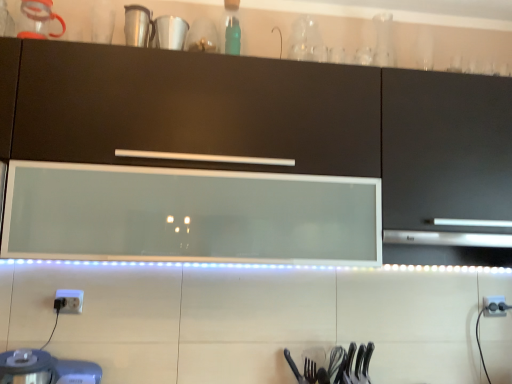
What is the approximate height of white glossy cup at upper center?

4.80 inches.

Measure the distance between transparent glass range hood at center and camera.

They are 4.12 feet apart.

Describe the element at coordinates (495, 306) in the screenshot. The image size is (512, 384). I see `white plastic electric outlet at lower right, the first electric outlet in the bottom-to-top sequence` at that location.

At what (x,y) coordinates should I click in order to perform the action: click on white plastic electric outlet at lower right, the first electric outlet in the bottom-to-top sequence. Please return your answer as a coordinate pair (x, y). Image resolution: width=512 pixels, height=384 pixels. Looking at the image, I should click on (495, 306).

The height and width of the screenshot is (384, 512). Identify the location of metallic silver blender at lower left. (45, 369).

Measure the distance between polished metal fork at lower center and camera.

5.27 feet.

This screenshot has height=384, width=512. Find the location of `white glossy cup at upper center`. white glossy cup at upper center is located at coordinates (170, 32).

From the image's perspective, does white glossy cup at upper center appear higher than transparent glass range hood at center?

Correct, white glossy cup at upper center appears higher than transparent glass range hood at center in the image.

Which of these two, white glossy cup at upper center or transparent glass range hood at center, stands shorter?

Standing shorter between the two is white glossy cup at upper center.

Does white glossy cup at upper center appear on the left side of transparent glass range hood at center?

Correct, you'll find white glossy cup at upper center to the left of transparent glass range hood at center.

In the scene shown: Is white glossy cup at upper center thinner than transparent glass range hood at center?

Yes, white glossy cup at upper center is thinner than transparent glass range hood at center.

From a real-world perspective, is metallic silver blender at lower left over white plastic electric outlet at lower left, positioned as the second electric outlet in right-to-left order?

No, from a real-world perspective, metallic silver blender at lower left is not over white plastic electric outlet at lower left, positioned as the second electric outlet in right-to-left order

Is metallic silver blender at lower left bigger than white plastic electric outlet at lower left, which ranks as the second electric outlet in bottom-to-top order?

Correct, metallic silver blender at lower left is larger in size than white plastic electric outlet at lower left, which ranks as the second electric outlet in bottom-to-top order.

Between metallic silver blender at lower left and white plastic electric outlet at lower left, which ranks as the second electric outlet in bottom-to-top order, which one has smaller width?

white plastic electric outlet at lower left, which ranks as the second electric outlet in bottom-to-top order, is thinner.

Could white plastic electric outlet at lower left, which is counted as the 2th electric outlet, starting from the back, be considered to be inside metallic silver blender at lower left?

No, white plastic electric outlet at lower left, which is counted as the 2th electric outlet, starting from the back, is located outside of metallic silver blender at lower left.

From a real-world perspective, is transparent glass range hood at center on matte black cabinet at center?

No, from a real-world perspective, transparent glass range hood at center is not on top of matte black cabinet at center.

From the image's perspective, is transparent glass range hood at center above matte black cabinet at center?

No.

Is transparent glass range hood at center far from matte black cabinet at center?

No, transparent glass range hood at center is not far away from matte black cabinet at center.

Does transparent glass range hood at center have a larger size compared to matte black cabinet at center?

Actually, transparent glass range hood at center might be smaller than matte black cabinet at center.

In the scene shown: Considering the relative sizes of white plastic electric outlet at lower left, which is counted as the first electric outlet, starting from the top, and polished metal fork at lower center in the image provided, is white plastic electric outlet at lower left, which is counted as the first electric outlet, starting from the top, shorter than polished metal fork at lower center?

Yes.

From a real-world perspective, which is physically above, white plastic electric outlet at lower left, positioned as the second electric outlet in right-to-left order, or polished metal fork at lower center?

From a 3D spatial view, white plastic electric outlet at lower left, positioned as the second electric outlet in right-to-left order, is above.

Is white plastic electric outlet at lower left, placed as the first electric outlet when sorted from front to back, positioned far away from polished metal fork at lower center?

white plastic electric outlet at lower left, placed as the first electric outlet when sorted from front to back, is actually quite close to polished metal fork at lower center.

In the image, is white plastic electric outlet at lower left, which ranks as the second electric outlet in bottom-to-top order, positioned in front of or behind polished metal fork at lower center?

white plastic electric outlet at lower left, which ranks as the second electric outlet in bottom-to-top order, is behind polished metal fork at lower center.

In the scene shown: Does transparent glass range hood at center have a lesser height compared to white glossy cup at upper center?

No.

Looking at this image, which object is further away from the camera taking this photo, transparent glass range hood at center or white glossy cup at upper center?

white glossy cup at upper center is behind.

From a real-world perspective, between transparent glass range hood at center and white glossy cup at upper center, who is vertically lower?

transparent glass range hood at center is physically lower.

Is matte black cabinet at center situated inside white plastic electric outlet at lower right, the first electric outlet when ordered from right to left, or outside?

matte black cabinet at center is not inside white plastic electric outlet at lower right, the first electric outlet when ordered from right to left, it's outside.

Considering the sizes of objects matte black cabinet at center and white plastic electric outlet at lower right, which ranks as the 1th electric outlet in back-to-front order, in the image provided, who is thinner, matte black cabinet at center or white plastic electric outlet at lower right, which ranks as the 1th electric outlet in back-to-front order,?

Thinner between the two is white plastic electric outlet at lower right, which ranks as the 1th electric outlet in back-to-front order.

Considering the sizes of objects matte black cabinet at center and white plastic electric outlet at lower right, the first electric outlet in the bottom-to-top sequence, in the image provided, who is taller, matte black cabinet at center or white plastic electric outlet at lower right, the first electric outlet in the bottom-to-top sequence,?

matte black cabinet at center.

Is matte black cabinet at center next to white plastic electric outlet at lower right, which appears as the second electric outlet when viewed from the top, and touching it?

→ No, matte black cabinet at center is not in contact with white plastic electric outlet at lower right, which appears as the second electric outlet when viewed from the top.

Is there a large distance between white plastic electric outlet at lower right, which ranks as the 1th electric outlet in back-to-front order, and metallic silver blender at lower left?

Absolutely, white plastic electric outlet at lower right, which ranks as the 1th electric outlet in back-to-front order, is distant from metallic silver blender at lower left.

Can you confirm if white plastic electric outlet at lower right, the first electric outlet in the bottom-to-top sequence, is wider than metallic silver blender at lower left?

In fact, white plastic electric outlet at lower right, the first electric outlet in the bottom-to-top sequence, might be narrower than metallic silver blender at lower left.

The image size is (512, 384). What are the coordinates of `appliance below the white plastic electric outlet at lower right, which appears as the second electric outlet when viewed from the top (from the image's perspective)` in the screenshot? It's located at (45, 369).

Which is in front, point (504, 299) or point (65, 383)?

The point (65, 383) is in front.

Find the location of `home appliance lying on the right of white glossy cup at upper center`. home appliance lying on the right of white glossy cup at upper center is located at coordinates (189, 215).

Which electric outlet is the 1st one when counting from the back of the metallic silver blender at lower left? Please provide its 2D coordinates.

[(68, 301)]

Considering their positions, is white plastic electric outlet at lower right, the first electric outlet when ordered from right to left, positioned further to white glossy cup at upper center than matte black cabinet at center?

Based on the image, white plastic electric outlet at lower right, the first electric outlet when ordered from right to left, appears to be further to white glossy cup at upper center.

Based on their spatial positions, is transparent glass range hood at center or polished metal fork at lower center closer to white glossy cup at upper center?

transparent glass range hood at center lies closer to white glossy cup at upper center than the other object.

Estimate the real-world distances between objects in this image. Which object is closer to polished metal fork at lower center, white glossy cup at upper center or metallic silver blender at lower left?

Based on the image, metallic silver blender at lower left appears to be nearer to polished metal fork at lower center.

Which object lies nearer to the anchor point transparent glass range hood at center, matte black cabinet at center or metallic silver blender at lower left?

The object closer to transparent glass range hood at center is matte black cabinet at center.

From the image, which object appears to be nearer to polished metal fork at lower center, metallic silver blender at lower left or transparent glass range hood at center?

transparent glass range hood at center.

When comparing their distances from white glossy cup at upper center, does white plastic electric outlet at lower left, which is counted as the first electric outlet, starting from the top, or white plastic electric outlet at lower right, which is the second electric outlet from front to back, seem further?

white plastic electric outlet at lower right, which is the second electric outlet from front to back, is further to white glossy cup at upper center.

Looking at the image, which one is located closer to white plastic electric outlet at lower left, which is counted as the first electric outlet, starting from the top, white plastic electric outlet at lower right, which is the second electric outlet from front to back, or white glossy cup at upper center?

white glossy cup at upper center is positioned closer to the anchor white plastic electric outlet at lower left, which is counted as the first electric outlet, starting from the top.

When comparing their distances from white plastic electric outlet at lower left, positioned as the second electric outlet in right-to-left order, does metallic silver blender at lower left or matte black cabinet at center seem closer?

metallic silver blender at lower left lies closer to white plastic electric outlet at lower left, positioned as the second electric outlet in right-to-left order, than the other object.

Image resolution: width=512 pixels, height=384 pixels. I want to click on silverware located between metallic silver blender at lower left and white plastic electric outlet at lower right, which ranks as the 1th electric outlet in back-to-front order, in the left-right direction, so click(x=310, y=371).

At what (x,y) coordinates should I click in order to perform the action: click on home appliance that lies between white glossy cup at upper center and metallic silver blender at lower left from top to bottom. Please return your answer as a coordinate pair (x, y). The width and height of the screenshot is (512, 384). Looking at the image, I should click on (189, 215).

Locate an element on the screen. The height and width of the screenshot is (384, 512). electric outlet situated between metallic silver blender at lower left and matte black cabinet at center from left to right is located at coordinates (68, 301).

The image size is (512, 384). Find the location of `home appliance located between white plastic electric outlet at lower left, placed as the first electric outlet when sorted from front to back, and matte black cabinet at center in the left-right direction`. home appliance located between white plastic electric outlet at lower left, placed as the first electric outlet when sorted from front to back, and matte black cabinet at center in the left-right direction is located at coordinates (189, 215).